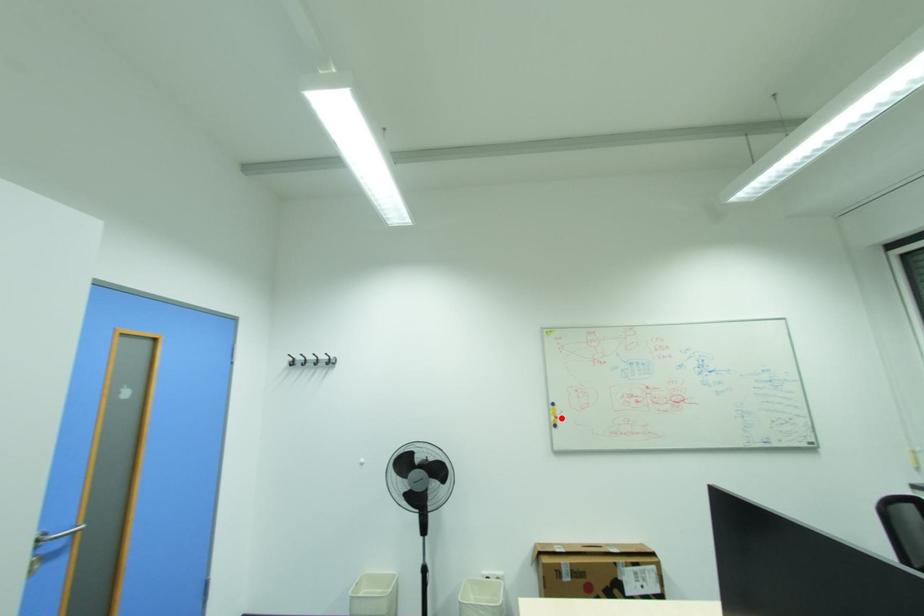
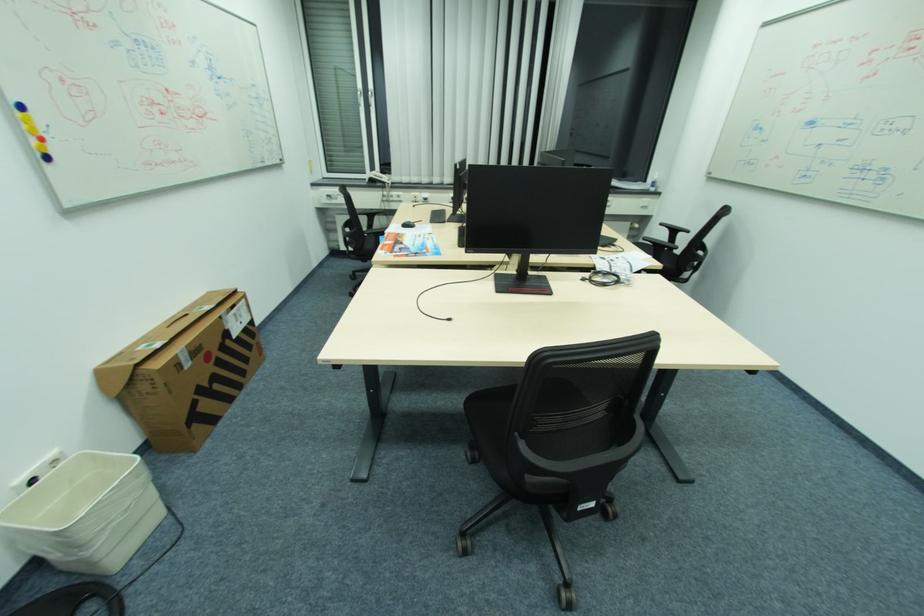
Find the pixel in the second image that matches the highlighted location in the first image.

(44, 140)